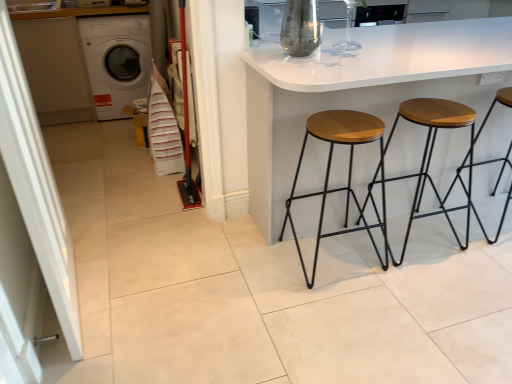
Question: Should I look upward or downward to see wooden/metallic stool at center, marked as the second stool in a right-to-left arrangement?

Choices:
 (A) up
 (B) down

Answer: (A)

Question: Is wooden seat at right, positioned as the first stool in right-to-left order, bigger than wooden barstools at center?

Choices:
 (A) yes
 (B) no

Answer: (B)

Question: Is wooden seat at right, the 3th stool in the left-to-right sequence, outside of wooden barstools at center?

Choices:
 (A) yes
 (B) no

Answer: (B)

Question: Could you tell me if wooden seat at right, positioned as the first stool in right-to-left order, is turned towards wooden barstools at center?

Choices:
 (A) yes
 (B) no

Answer: (A)

Question: Would you say wooden seat at right, the 3th stool in the left-to-right sequence, contains wooden barstools at center?

Choices:
 (A) no
 (B) yes

Answer: (A)

Question: From the image's perspective, does wooden seat at right, the 3th stool in the left-to-right sequence, appear lower than wooden barstools at center?

Choices:
 (A) yes
 (B) no

Answer: (A)

Question: Can you confirm if wooden seat at right, positioned as the first stool in right-to-left order, is positioned to the right of wooden barstools at center?

Choices:
 (A) yes
 (B) no

Answer: (B)

Question: Is white striped fabric at left wider than wooden barstools at center?

Choices:
 (A) yes
 (B) no

Answer: (B)

Question: Can you see white striped fabric at left touching wooden barstools at center?

Choices:
 (A) yes
 (B) no

Answer: (B)

Question: From a real-world perspective, is white striped fabric at left on top of wooden barstools at center?

Choices:
 (A) no
 (B) yes

Answer: (A)

Question: Is white striped fabric at left bigger than wooden barstools at center?

Choices:
 (A) yes
 (B) no

Answer: (B)

Question: Is white striped fabric at left smaller than wooden barstools at center?

Choices:
 (A) no
 (B) yes

Answer: (B)

Question: Is white striped fabric at left shorter than wooden barstools at center?

Choices:
 (A) yes
 (B) no

Answer: (A)

Question: Is white striped fabric at left not within wooden/metallic stool at center, marked as the second stool in a right-to-left arrangement?

Choices:
 (A) no
 (B) yes

Answer: (B)